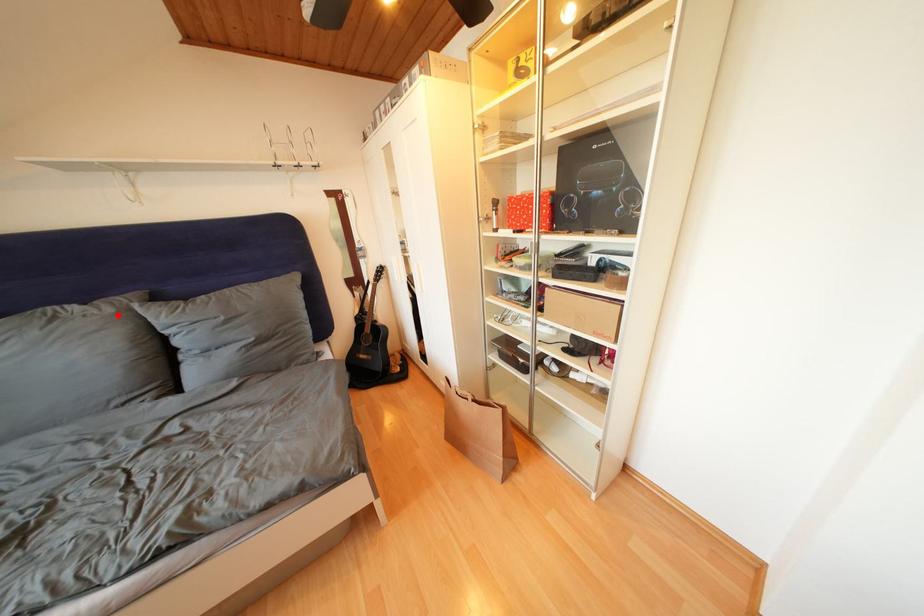
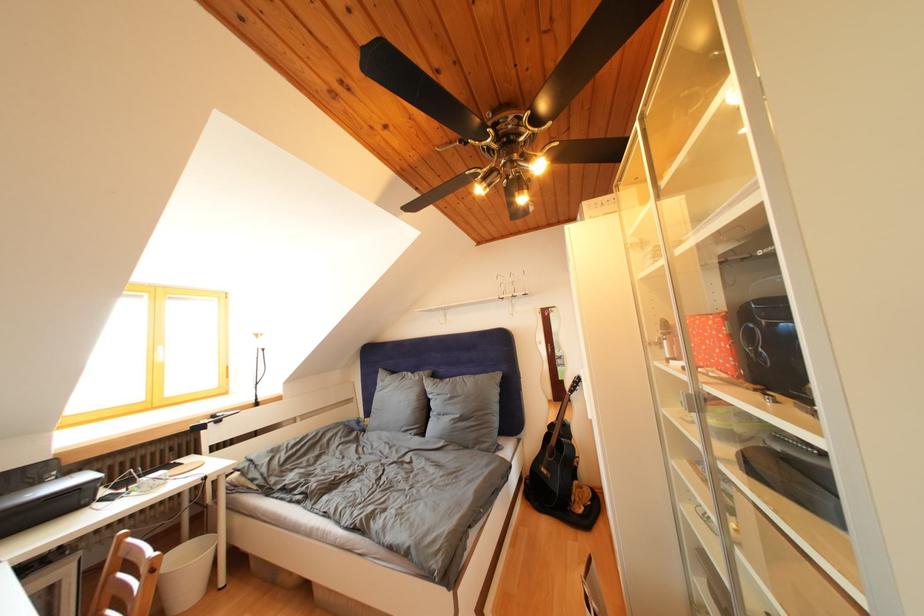
Question: I am providing you with two images of the same scene from different viewpoints. A red point is marked on the first image. Is the red point's position out of view in image 2?

Choices:
 (A) Yes
 (B) No

Answer: (B)